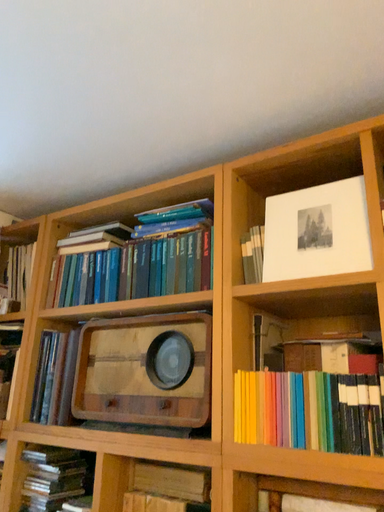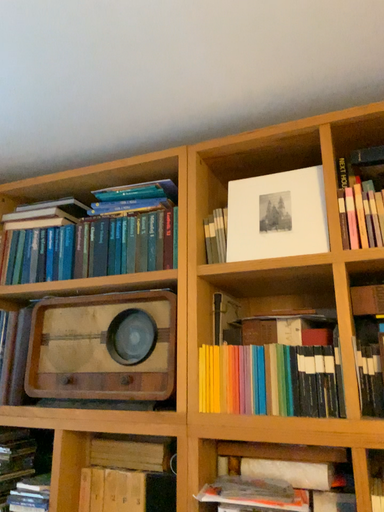
Question: Which way did the camera rotate in the video?

Choices:
 (A) rotated left
 (B) rotated right

Answer: (B)